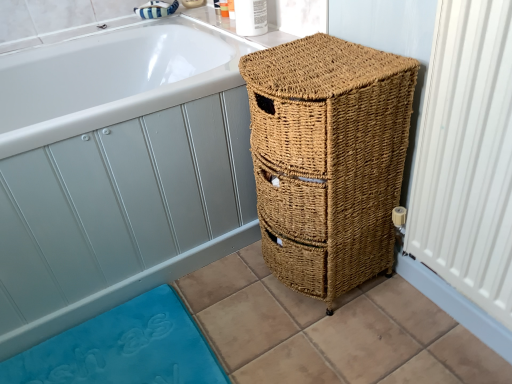
Find the location of a particular element. The width and height of the screenshot is (512, 384). vacant area on top of blue rubber bath mat at lower left (from a real-world perspective) is located at coordinates (118, 351).